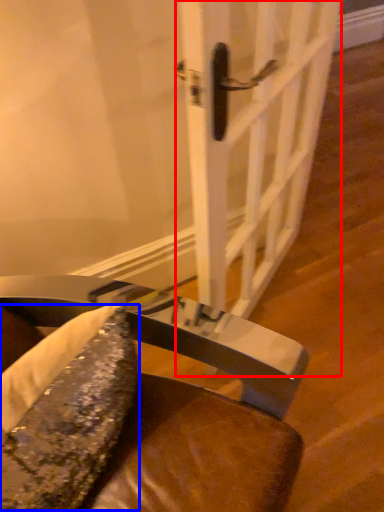
Question: Which of the following is the farthest to the observer, door (highlighted by a red box) or food (highlighted by a blue box)?

Choices:
 (A) door
 (B) food

Answer: (A)